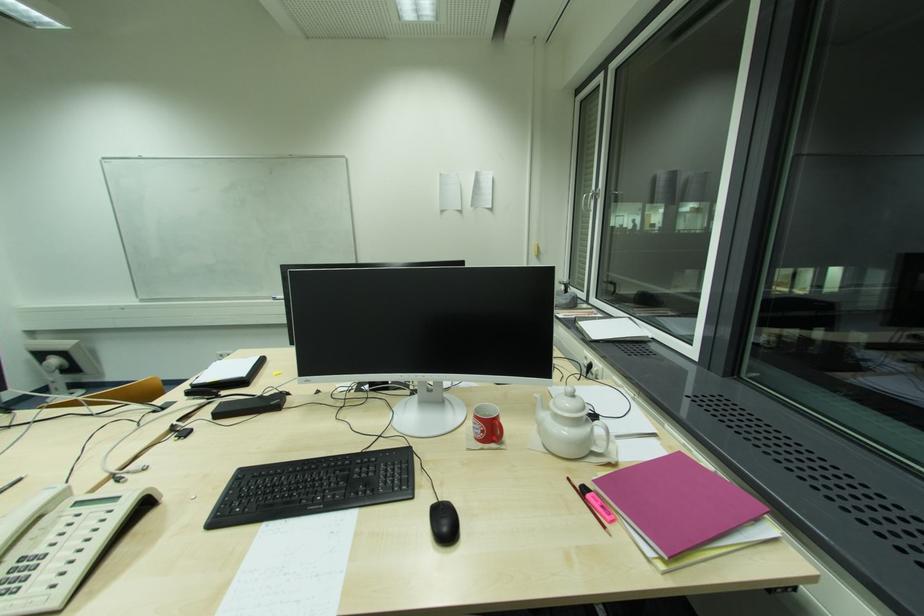
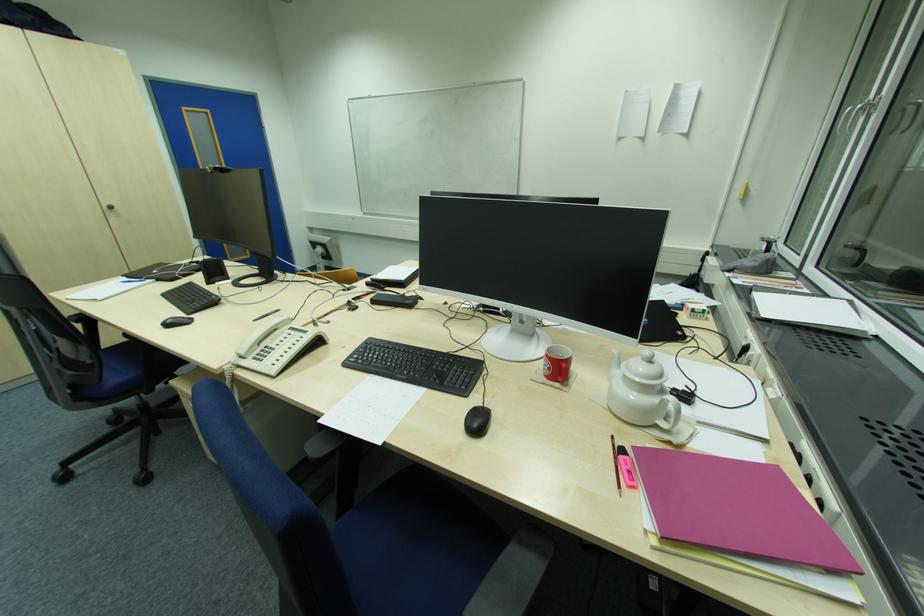
Find the pixel in the second image that matches (x=587, y=197) in the first image.

(850, 111)